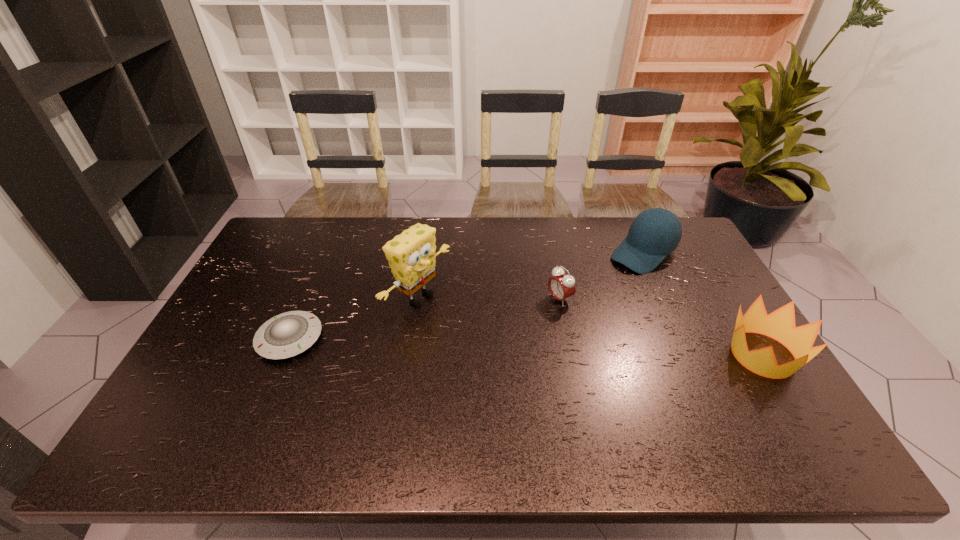
I want to click on vacant space in between the crown and the sponge, so click(590, 326).

Where is `vacant space in between the second tallest object and the crown`? The image size is (960, 540). vacant space in between the second tallest object and the crown is located at coordinates tap(703, 304).

This screenshot has height=540, width=960. In order to click on vacant region between the crown and the leftmost object in this screenshot , I will do `click(526, 347)`.

Where is `vacant region between the saucer and the tallest object`? vacant region between the saucer and the tallest object is located at coordinates [x=354, y=318].

Identify the location of free space between the alarm clock and the leftmost object. This screenshot has width=960, height=540. (424, 319).

Identify the location of unoccupied area between the shortest object and the crown. The width and height of the screenshot is (960, 540). (526, 347).

Identify the location of free spot between the crown and the tallest object. (590, 326).

What are the coordinates of `vacant space that's between the crown and the sponge` in the screenshot? It's located at (590, 326).

Image resolution: width=960 pixels, height=540 pixels. Identify the location of vacant area between the baseball cap and the tallest object. (531, 275).

Where is `free space between the leftmost object and the sponge`? free space between the leftmost object and the sponge is located at coordinates (354, 318).